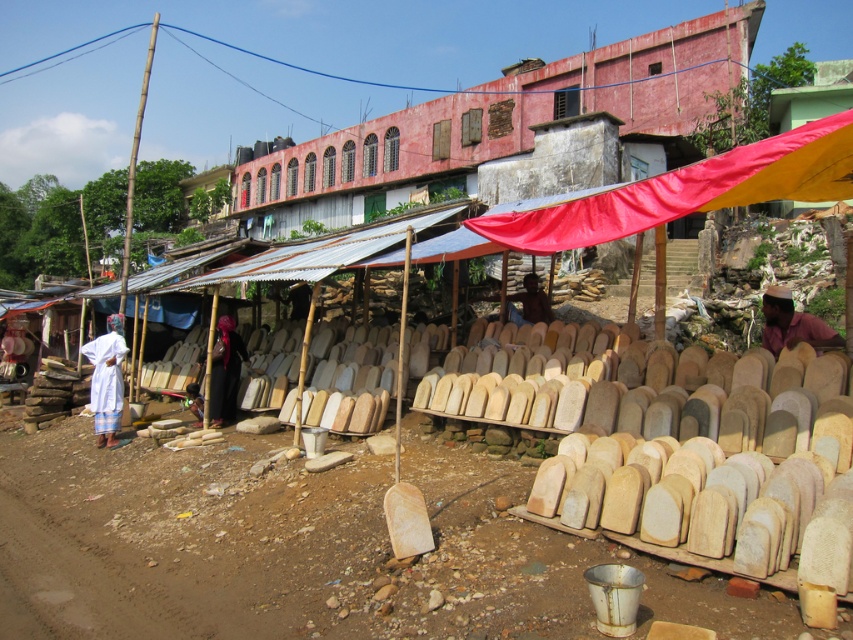
Question: Which of these objects is positioned farthest from the red fabric canopy at center?

Choices:
 (A) black fabric at center
 (B) brown fabric at right

Answer: (A)

Question: Where is black fabric at center located in relation to brown skin at center in the image?

Choices:
 (A) left
 (B) right

Answer: (A)

Question: Can you confirm if red fabric canopy at center is thinner than white cloth at left?

Choices:
 (A) no
 (B) yes

Answer: (A)

Question: Is red fabric canopy at center closer to camera compared to black fabric at center?

Choices:
 (A) yes
 (B) no

Answer: (A)

Question: Which object appears closest to the camera in this image?

Choices:
 (A) brown fabric at right
 (B) white cloth at left

Answer: (A)

Question: Which object is closer to the camera taking this photo?

Choices:
 (A) brown skin at center
 (B) white cloth at left
 (C) brown fabric at right
 (D) red fabric canopy at center

Answer: (D)